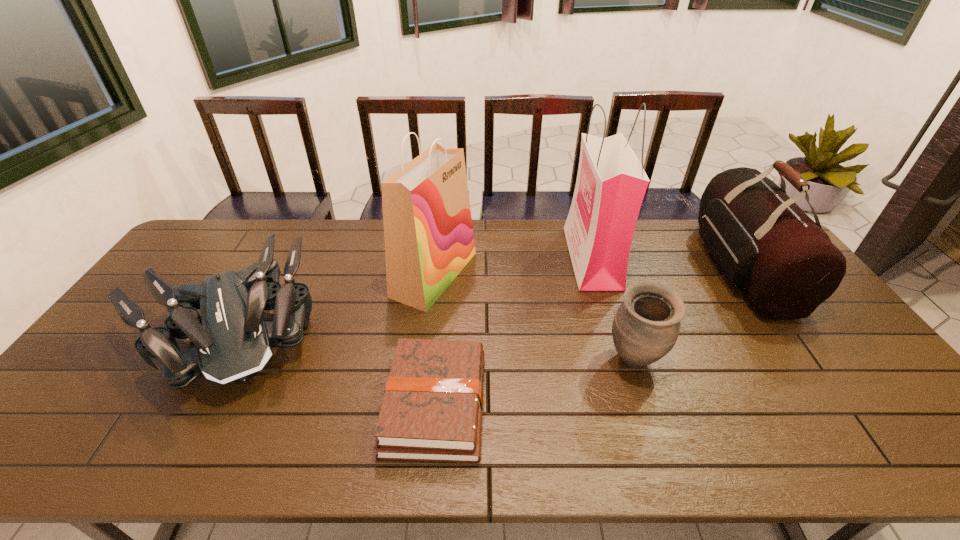
Find the location of `vacant space located 0.170m on the front-facing side of the right shopping bag`. vacant space located 0.170m on the front-facing side of the right shopping bag is located at coordinates (519, 258).

The image size is (960, 540). What are the coordinates of `vacant region located on the left of the left shopping bag` in the screenshot? It's located at (281, 274).

At what (x,y) coordinates should I click in order to perform the action: click on vacant region located 0.090m on the front pocket of the rightmost object. Please return your answer as a coordinate pair (x, y). Looking at the image, I should click on (678, 268).

Where is `free location located on the front pocket of the rightmost object`? free location located on the front pocket of the rightmost object is located at coordinates pyautogui.click(x=616, y=268).

Find the location of a particular element. This screenshot has width=960, height=540. vacant space located on the front pocket of the rightmost object is located at coordinates (592, 268).

The width and height of the screenshot is (960, 540). Identify the location of free region located on the front of the third shortest object. (648, 402).

Locate an element on the screen. This screenshot has width=960, height=540. blank space located 0.130m on the right of the drone is located at coordinates (364, 332).

Where is `vacant space located 0.070m on the right of the shortest object`? The image size is (960, 540). vacant space located 0.070m on the right of the shortest object is located at coordinates (514, 404).

The image size is (960, 540). Identify the location of duffel bag at the far edge. (785, 265).

Locate an element on the screen. Image resolution: width=960 pixels, height=540 pixels. object that is at the near edge is located at coordinates (432, 408).